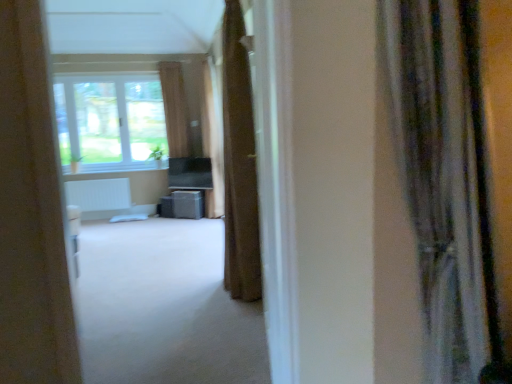
Question: Does silky gray curtain at right, the first curtain from the front, lie behind matte gray speaker at center?

Choices:
 (A) yes
 (B) no

Answer: (B)

Question: Considering the relative sizes of silky gray curtain at right, the first curtain from the front, and matte gray speaker at center in the image provided, is silky gray curtain at right, the first curtain from the front, bigger than matte gray speaker at center?

Choices:
 (A) yes
 (B) no

Answer: (A)

Question: Is silky gray curtain at right, placed as the 4th curtain when sorted from left to right, looking in the opposite direction of matte gray speaker at center?

Choices:
 (A) yes
 (B) no

Answer: (A)

Question: Does silky gray curtain at right, positioned as the 4th curtain in back-to-front order, turn towards matte gray speaker at center?

Choices:
 (A) yes
 (B) no

Answer: (B)

Question: Is silky gray curtain at right, the first curtain from the front, not near matte gray speaker at center?

Choices:
 (A) no
 (B) yes

Answer: (B)

Question: Do you think white carpet at center is within brown fabric curtain at center, which appears as the 1th curtain when viewed from the left, or outside of it?

Choices:
 (A) outside
 (B) inside

Answer: (A)

Question: Considering the positions of point (219, 311) and point (181, 67), is point (219, 311) closer or farther from the camera than point (181, 67)?

Choices:
 (A) farther
 (B) closer

Answer: (B)

Question: In the image, is white carpet at center positioned in front of or behind brown fabric curtain at center, which appears as the 1th curtain when viewed from the left?

Choices:
 (A) behind
 (B) front

Answer: (B)

Question: Looking at the image, does white carpet at center seem bigger or smaller compared to brown fabric curtain at center, which appears as the 1th curtain when viewed from the left?

Choices:
 (A) big
 (B) small

Answer: (A)

Question: Looking at the image, does brown fabric curtain at center, the 3th curtain from the back, seem bigger or smaller compared to white carpet at center?

Choices:
 (A) small
 (B) big

Answer: (A)

Question: Considering the relative positions of brown fabric curtain at center, the 3th curtain viewed from the left, and white carpet at center in the image provided, is brown fabric curtain at center, the 3th curtain viewed from the left, to the left or to the right of white carpet at center?

Choices:
 (A) left
 (B) right

Answer: (B)

Question: From a real-world perspective, is brown fabric curtain at center, placed as the second curtain when sorted from front to back, positioned above or below white carpet at center?

Choices:
 (A) above
 (B) below

Answer: (A)

Question: Is point (241, 91) positioned closer to the camera than point (106, 253)?

Choices:
 (A) farther
 (B) closer

Answer: (B)

Question: Is white carpet at center bigger or smaller than brown fabric curtain at center, which appears as the 2th curtain when viewed from the back?

Choices:
 (A) small
 (B) big

Answer: (B)

Question: Looking at their shapes, would you say white carpet at center is wider or thinner than brown fabric curtain at center, which is the 2th curtain from left to right?

Choices:
 (A) wide
 (B) thin

Answer: (A)